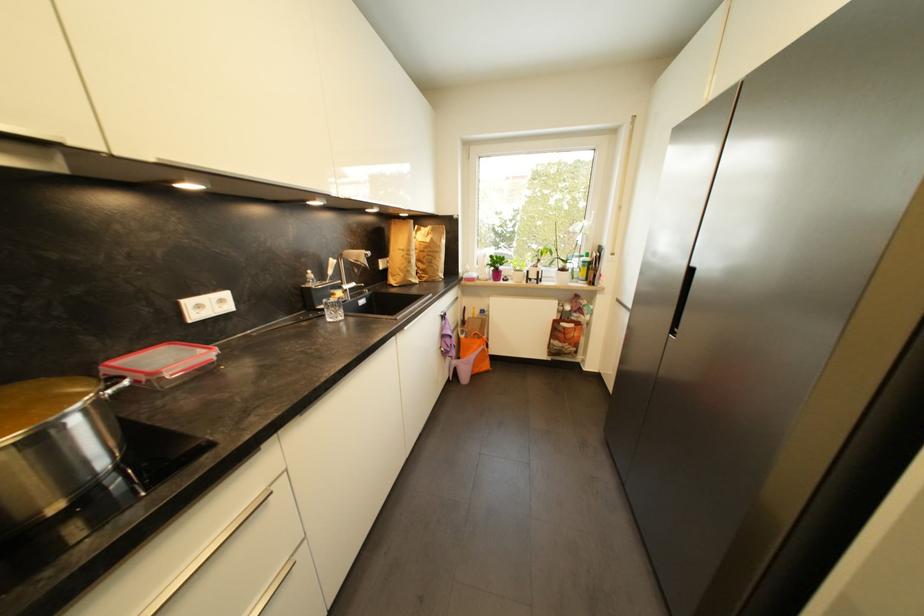
Which object does [333,310] point to?

It corresponds to the drinking glass in the image.